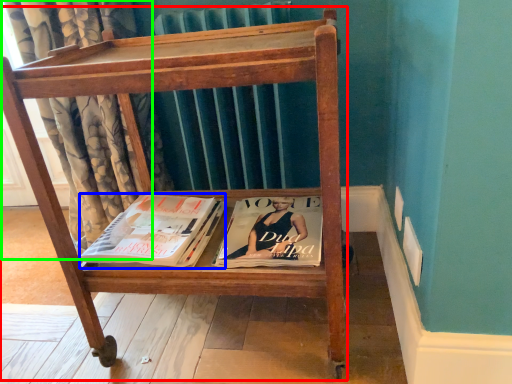
Question: Which is farther away from furniture (highlighted by a red box)? book (highlighted by a blue box) or curtain (highlighted by a green box)?

Choices:
 (A) book
 (B) curtain

Answer: (B)